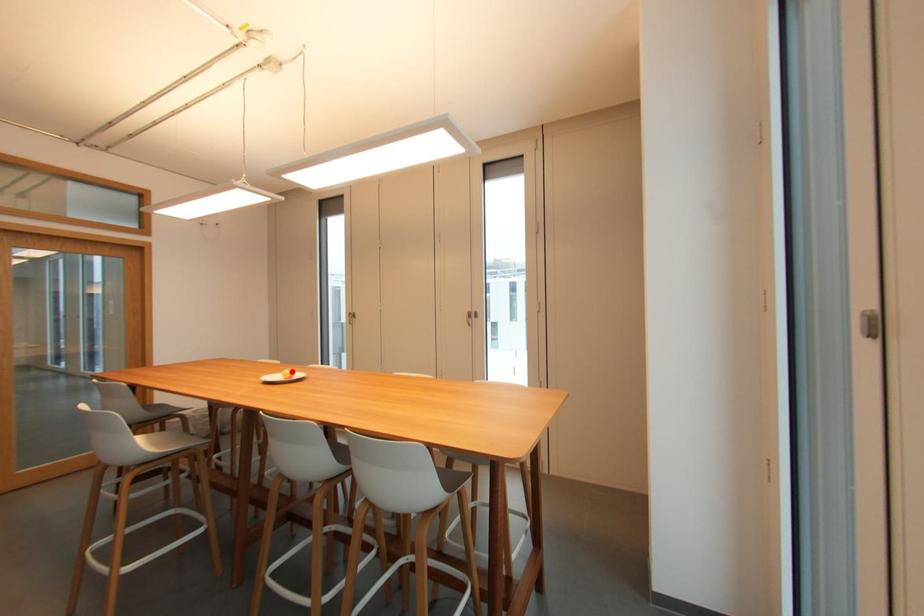
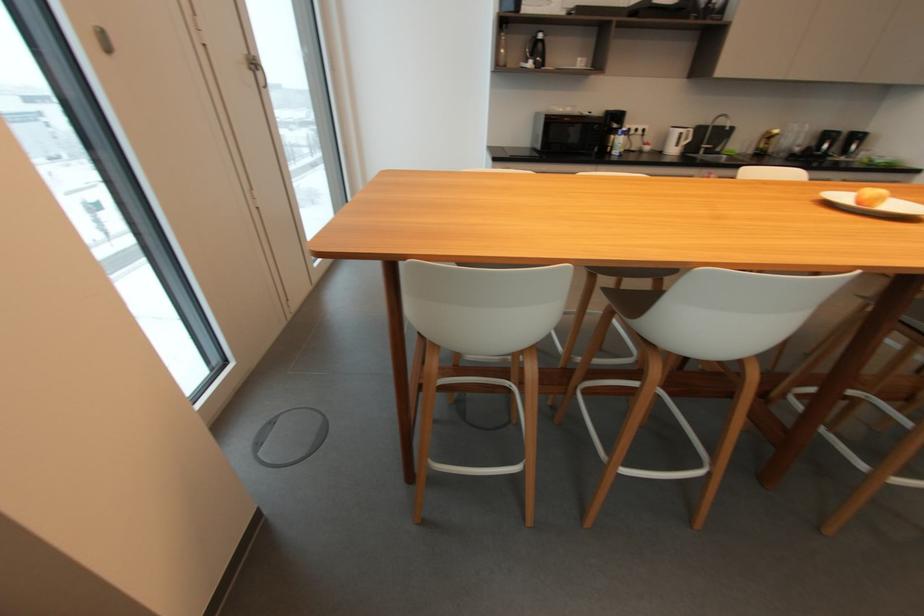
Question: I am providing you with two images of the same scene from different viewpoints. Image1 has a red point marked. In image2, the corresponding 3D location appears at what relative position? Reply with the corresponding letter.

Choices:
 (A) Closer
 (B) Farther

Answer: (B)